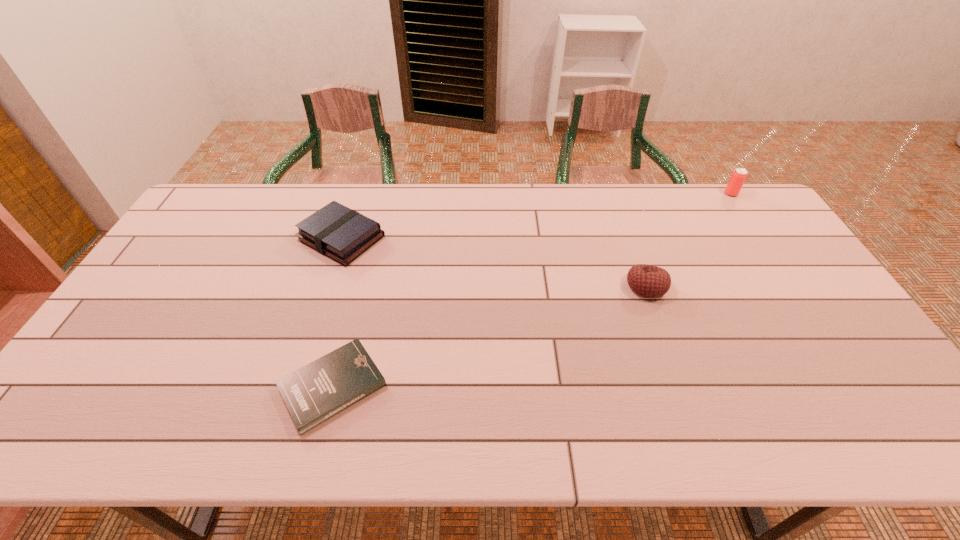
You are a GUI agent. You are given a task and a screenshot of the screen. Output one action in this format:
    pyautogui.click(x=<x>, y=<y>)
    Task: Click on the free location located 0.160m on the right of the taller book
    The width and height of the screenshot is (960, 540).
    Given the screenshot: What is the action you would take?
    pyautogui.click(x=434, y=238)

Where is `vacant space situated 0.110m on the right of the shortest object`? This screenshot has width=960, height=540. vacant space situated 0.110m on the right of the shortest object is located at coordinates (432, 386).

Find the location of a particular element. beer can present at the far edge is located at coordinates (738, 177).

Find the location of a particular element. This screenshot has width=960, height=540. book that is at the far edge is located at coordinates (342, 234).

Locate an element on the screen. The height and width of the screenshot is (540, 960). object situated at the near edge is located at coordinates (314, 393).

Where is `object present at the right edge`? The height and width of the screenshot is (540, 960). object present at the right edge is located at coordinates (738, 177).

Locate an element on the screen. The image size is (960, 540). object that is at the far right corner is located at coordinates (738, 177).

At what (x,y) coordinates should I click in order to perform the action: click on vacant space at the far edge of the desktop. Please return your answer as a coordinate pair (x, y). This screenshot has width=960, height=540. Looking at the image, I should click on (598, 205).

Where is `vacant space at the near edge of the desktop`? Image resolution: width=960 pixels, height=540 pixels. vacant space at the near edge of the desktop is located at coordinates (156, 434).

At what (x,y) coordinates should I click in order to perform the action: click on vacant space at the left edge of the desktop. Please return your answer as a coordinate pair (x, y). This screenshot has height=540, width=960. Looking at the image, I should click on (108, 363).